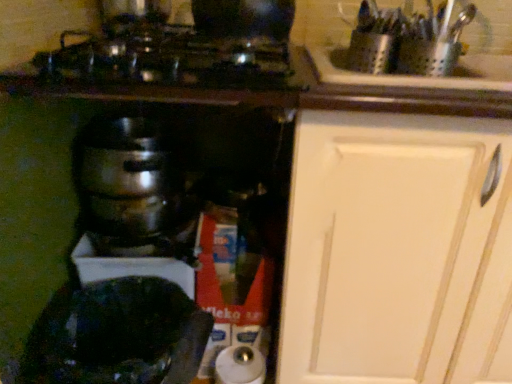
Question: From the image's perspective, is shiny black pot at lower left above or below shiny metallic cookware at upper center?

Choices:
 (A) below
 (B) above

Answer: (A)

Question: Considering the positions of point (126, 372) and point (238, 79), is point (126, 372) closer or farther from the camera than point (238, 79)?

Choices:
 (A) farther
 (B) closer

Answer: (A)

Question: Based on their relative distances, which object is farther from the white matte cabinet at upper right?

Choices:
 (A) shiny black pot at lower left
 (B) shiny metallic cookware at upper center
 (C) shiny metallic pot at center

Answer: (C)

Question: Which object is positioned closest to the shiny metallic pot at center?

Choices:
 (A) shiny metallic cookware at upper center
 (B) shiny black pot at lower left
 (C) white matte cabinet at upper right

Answer: (B)